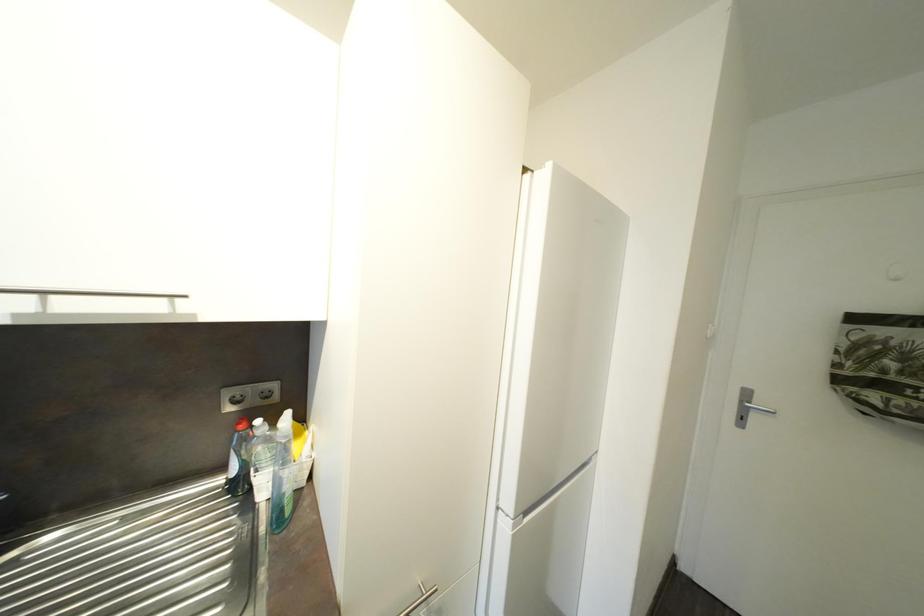
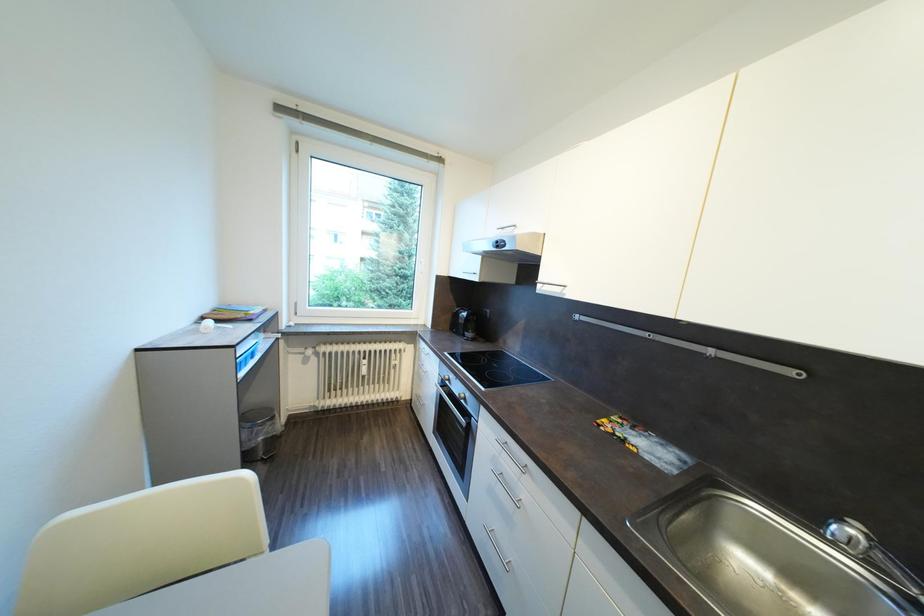
Question: The camera is either moving clockwise (left) or counter-clockwise (right) around the object. The first image is from the beginning of the video and the second image is from the end. Is the camera moving left or right when shooting the video?

Choices:
 (A) Left
 (B) Right

Answer: (B)